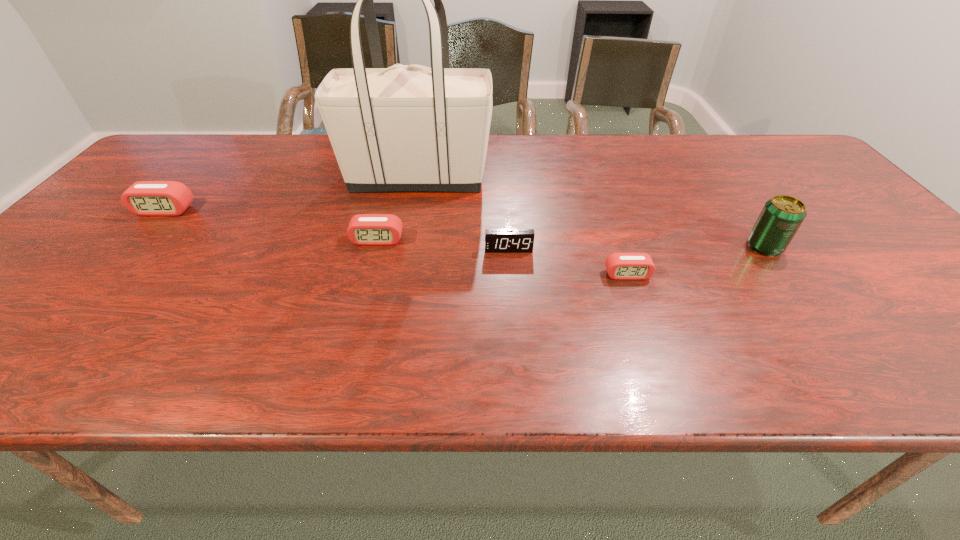
Find the location of a particular element. The width and height of the screenshot is (960, 540). free point that keeps the alarm clocks evenly spaced on the right is located at coordinates (926, 316).